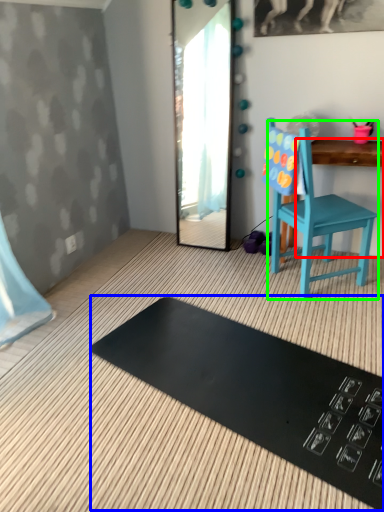
Question: Which object is positioned closest to changing table (highlighted by a red box)? Select from mat (highlighted by a blue box) and chair (highlighted by a green box).

Choices:
 (A) mat
 (B) chair

Answer: (B)